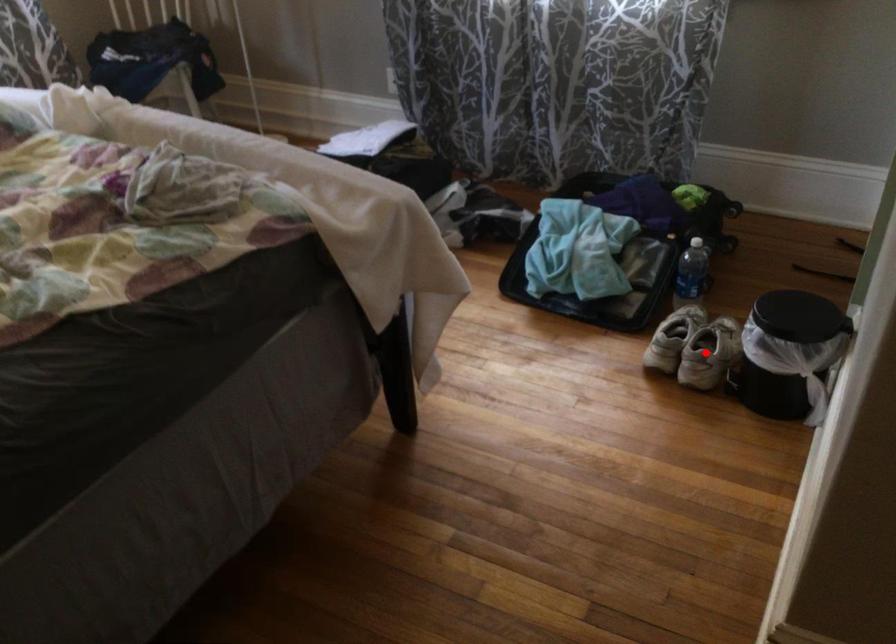
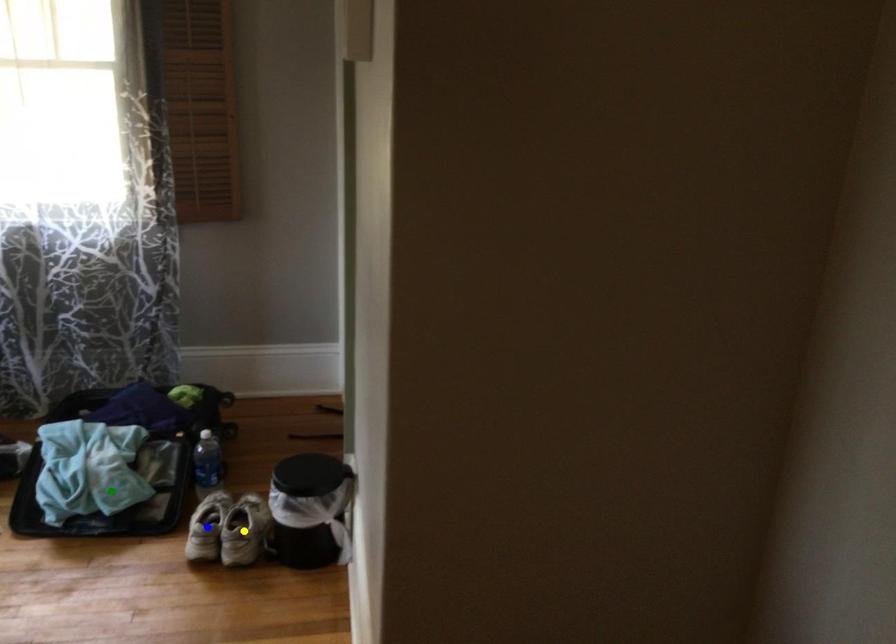
Question: I am providing you with two images of the same scene from different viewpoints. A red point is marked on the first image. You are given multiple points on the second image. Which spot in image 2 lines up with the point in image 1?

Choices:
 (A) yellow point
 (B) green point
 (C) blue point

Answer: (A)